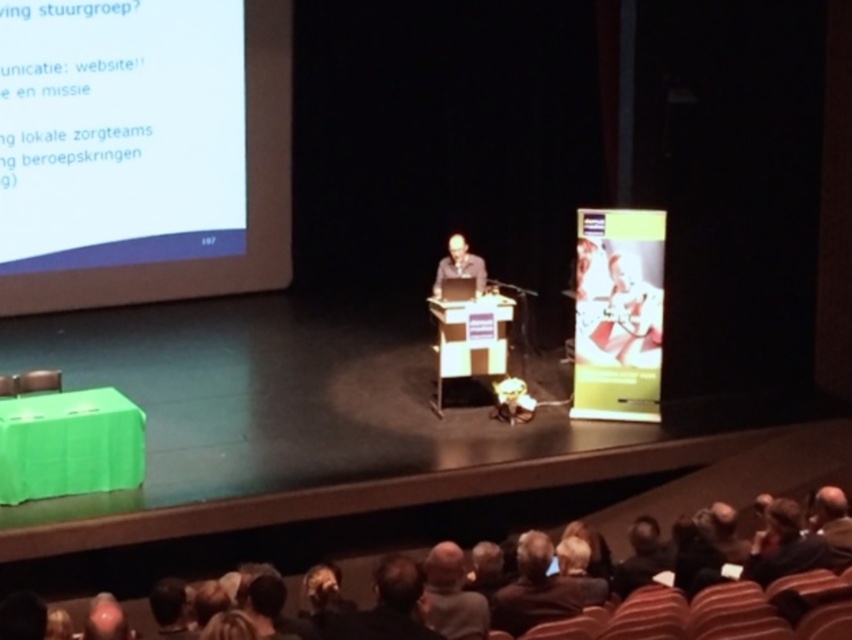
You are an attendee at the conference and you want to take a photo of the speaker. The speaker is wearing a dark gray shirt at center and a brown leather jacket at lower center. Which clothing item should you focus on to ensure the photo includes both the speaker and the projection screen displaying the Dutch text?

The brown leather jacket at lower center is smaller in size compared to the dark gray shirt at center. To include both the speaker and the projection screen in the photo, focus on the dark gray shirt at center since it is larger and more prominent, making it easier to frame the speaker alongside the screen.

You are an attendee at the conference and want to take a photo of the screen. You are standing at point (436, 608). Can you see the point (102, 68) in your photo if you take it from your current position?

Since point (102, 68) is behind point (436, 608), you cannot see point (102, 68) in your photo taken from point (436, 608) because it is obscured by the latter.

You are an attendee at the conference and you want to identify the speaker based on their clothing. The speaker is wearing a dark gray shirt at center and a brown leather jacket at center. Which clothing item is lower on the speaker?

The brown leather jacket at center is positioned under the dark gray shirt at center, so the jacket is lower on the speaker.